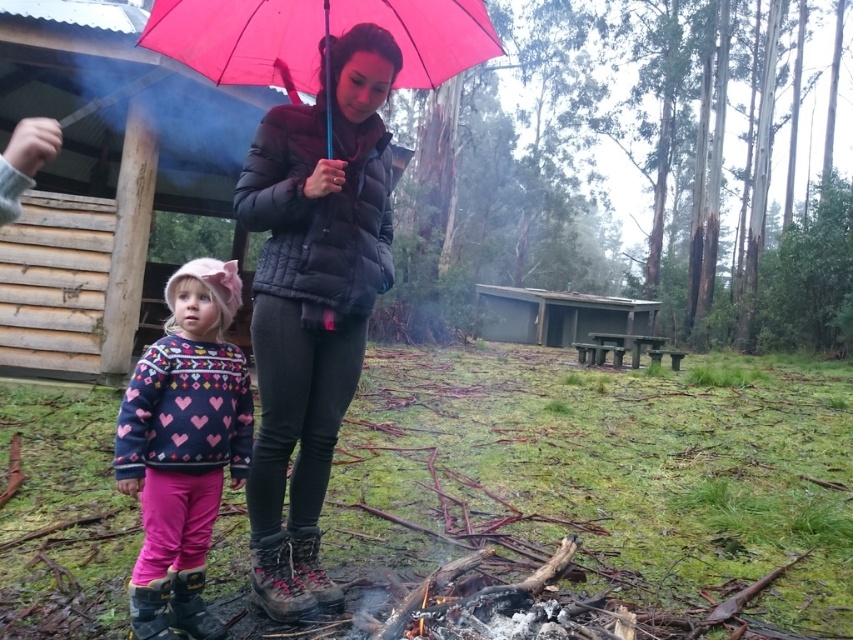
Is matte black puffer jacket at center in front of pink matte umbrella at upper center?

Yes, it is in front of pink matte umbrella at upper center.

Which is behind, point (310, 589) or point (294, 97)?

The point (294, 97) is more distant.

Locate an element on the screen. This screenshot has height=640, width=853. matte black puffer jacket at center is located at coordinates (312, 301).

Can you confirm if dark blue fleece sweater with hearts at lower left is positioned to the left of pink matte umbrella at upper center?

Indeed, dark blue fleece sweater with hearts at lower left is positioned on the left side of pink matte umbrella at upper center.

Is point (144, 401) positioned before point (233, 38)?

Yes, point (144, 401) is in front of point (233, 38).

Is point (138, 609) farther from viewer compared to point (265, 40)?

No, (138, 609) is closer to viewer.

Find the location of a particular element. The width and height of the screenshot is (853, 640). dark blue fleece sweater with hearts at lower left is located at coordinates (183, 448).

This screenshot has height=640, width=853. What do you see at coordinates (312, 301) in the screenshot?
I see `matte black puffer jacket at center` at bounding box center [312, 301].

Identify the location of matte black puffer jacket at center. (312, 301).